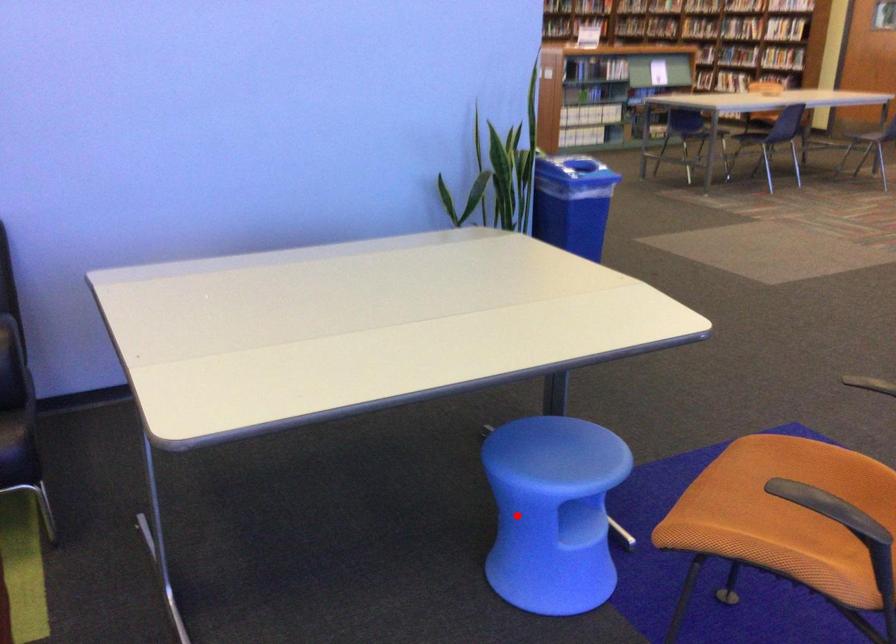
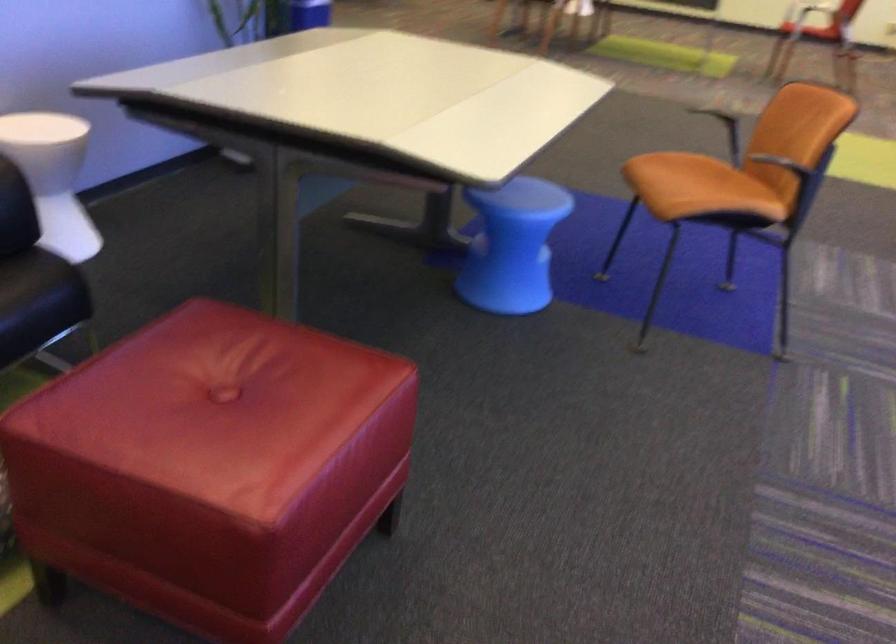
Question: I am providing you with two images of the same scene from different viewpoints. A red point is shown in image1. For the corresponding object point in image2, is it positioned nearer or farther from the camera?

Choices:
 (A) Nearer
 (B) Farther

Answer: (B)